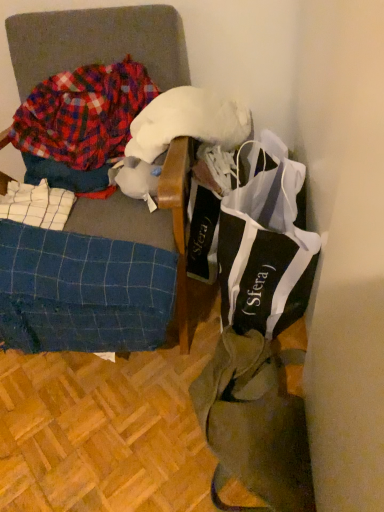
Describe the element at coordinates (100, 42) in the screenshot. I see `blue plaid fabric at left` at that location.

Image resolution: width=384 pixels, height=512 pixels. What do you see at coordinates (83, 114) in the screenshot? I see `plaid flannel shirt at left` at bounding box center [83, 114].

In order to face plaid flannel shirt at left, should I rotate leftwards or rightwards?

You should look left and rotate roughly 14.335 degrees.

Measure the distance between black and white fabric bag at right and camera.

black and white fabric bag at right and camera are 93.45 centimeters apart from each other.

This screenshot has width=384, height=512. What do you see at coordinates (266, 246) in the screenshot?
I see `black and white fabric bag at right` at bounding box center [266, 246].

Identify the location of blue plaid fabric at left. The image size is (384, 512). (100, 42).

Between white fluffy wool at upper center and blue checkered fabric at lower left, which one has larger width?

With larger width is white fluffy wool at upper center.

Is white fluffy wool at upper center with blue checkered fabric at lower left?

No, white fluffy wool at upper center is not with blue checkered fabric at lower left.

Is the depth of white fluffy wool at upper center greater than that of blue checkered fabric at lower left?

Yes, the depth of white fluffy wool at upper center is greater than that of blue checkered fabric at lower left.

In the scene shown: Is white fluffy wool at upper center at the left side of blue checkered fabric at lower left?

In fact, white fluffy wool at upper center is to the right of blue checkered fabric at lower left.

Based on the photo, is blue plaid fabric at left looking in the opposite direction of black and white fabric bag at right?

No.

From the image's perspective, would you say blue plaid fabric at left is shown under black and white fabric bag at right?

No, from the image's perspective, blue plaid fabric at left is not beneath black and white fabric bag at right.

Which is behind, point (134, 56) or point (302, 306)?

Point (302, 306)

Does blue plaid fabric at left appear on the left side of black and white fabric bag at right?

Indeed, blue plaid fabric at left is positioned on the left side of black and white fabric bag at right.

Who is more distant, black and white fabric bag at right or blue plaid fabric at left?

black and white fabric bag at right.

Considering the relative sizes of black and white fabric bag at right and blue plaid fabric at left in the image provided, is black and white fabric bag at right taller than blue plaid fabric at left?

In fact, black and white fabric bag at right may be shorter than blue plaid fabric at left.

Is black and white fabric bag at right spatially inside blue plaid fabric at left, or outside of it?

black and white fabric bag at right cannot be found inside blue plaid fabric at left.

Measure the distance from blue checkered fabric at lower left to white fluffy wool at upper center.

16.30 inches.

Is white fluffy wool at upper center surrounded by blue checkered fabric at lower left?

No, white fluffy wool at upper center is located outside of blue checkered fabric at lower left.

What's the angular difference between blue checkered fabric at lower left and white fluffy wool at upper center's facing directions?

blue checkered fabric at lower left and white fluffy wool at upper center are facing 40 degrees away from each other.

From the image's perspective, which object appears higher, blue checkered fabric at lower left or white fluffy wool at upper center?

white fluffy wool at upper center.

Measure the distance from plaid flannel shirt at left to black and white fabric bag at right.

plaid flannel shirt at left is 19.67 inches away from black and white fabric bag at right.

Would you say plaid flannel shirt at left is a long distance from black and white fabric bag at right?

plaid flannel shirt at left is near black and white fabric bag at right, not far away.

Looking at this image, from the image's perspective, which object appears higher, plaid flannel shirt at left or black and white fabric bag at right?

plaid flannel shirt at left appears higher in the image.

Could you tell me if plaid flannel shirt at left is turned towards black and white fabric bag at right?

No, plaid flannel shirt at left is not oriented towards black and white fabric bag at right.

Between white fluffy wool at upper center and olive green canvas tote bag at lower right, which one has smaller width?

white fluffy wool at upper center is thinner.

Is white fluffy wool at upper center taller or shorter than olive green canvas tote bag at lower right?

white fluffy wool at upper center is shorter than olive green canvas tote bag at lower right.

Which is closer, (177, 112) or (280, 375)?

Clearly, point (177, 112) is closer to the camera than point (280, 375).

In the scene shown: From a real-world perspective, relative to olive green canvas tote bag at lower right, is white fluffy wool at upper center vertically above or below?

white fluffy wool at upper center is situated higher than olive green canvas tote bag at lower right in the real world.

Is there a large distance between blue checkered fabric at lower left and black and white fabric bag at right?

No, blue checkered fabric at lower left is not far away from black and white fabric bag at right.

In the scene shown: Considering the sizes of blue checkered fabric at lower left and black and white fabric bag at right in the image, is blue checkered fabric at lower left taller or shorter than black and white fabric bag at right?

In the image, blue checkered fabric at lower left appears to be shorter than black and white fabric bag at right.

From the image's perspective, which is below, blue checkered fabric at lower left or black and white fabric bag at right?

blue checkered fabric at lower left appears lower in the image.

Is blue checkered fabric at lower left not inside black and white fabric bag at right?

blue checkered fabric at lower left lies outside black and white fabric bag at right's area.

I want to click on underclothes below the white fluffy wool at upper center (from the image's perspective), so click(x=82, y=292).

Identify the location of grocery bag behind the blue plaid fabric at left. This screenshot has height=512, width=384. (266, 246).

Based on the photo, from the image, which object appears to be farther from white fluffy wool at upper center, blue plaid fabric at left or black and white fabric bag at right?

Based on the image, black and white fabric bag at right appears to be further to white fluffy wool at upper center.

Based on their spatial positions, is black and white fabric bag at right or olive green canvas tote bag at lower right further from plaid flannel shirt at left?

olive green canvas tote bag at lower right.

Based on their spatial positions, is white fluffy wool at upper center or black and white fabric bag at right further from plaid flannel shirt at left?

Based on the image, black and white fabric bag at right appears to be further to plaid flannel shirt at left.

Estimate the real-world distances between objects in this image. Which object is further from blue checkered fabric at lower left, black and white fabric bag at right or plaid flannel shirt at left?

plaid flannel shirt at left is positioned further to the anchor blue checkered fabric at lower left.

Based on their spatial positions, is blue checkered fabric at lower left or plaid flannel shirt at left closer to white fluffy wool at upper center?

plaid flannel shirt at left lies closer to white fluffy wool at upper center than the other object.

Looking at the image, which one is located closer to black and white fabric bag at right, blue plaid fabric at left or blue checkered fabric at lower left?

blue checkered fabric at lower left lies closer to black and white fabric bag at right than the other object.

Looking at the image, which one is located closer to blue checkered fabric at lower left, blue plaid fabric at left or olive green canvas tote bag at lower right?

olive green canvas tote bag at lower right lies closer to blue checkered fabric at lower left than the other object.

Considering their positions, is black and white fabric bag at right positioned further to olive green canvas tote bag at lower right than blue plaid fabric at left?

blue plaid fabric at left.

At what (x,y) coordinates should I click in order to perform the action: click on wool that lies between plaid flannel shirt at left and blue checkered fabric at lower left from top to bottom. Please return your answer as a coordinate pair (x, y). The image size is (384, 512). Looking at the image, I should click on (187, 122).

Where is `underclothes between blue plaid fabric at left and black and white fabric bag at right from left to right`? This screenshot has width=384, height=512. underclothes between blue plaid fabric at left and black and white fabric bag at right from left to right is located at coordinates (82, 292).

Locate an element on the screen. Image resolution: width=384 pixels, height=512 pixels. grocery bag that lies between blue plaid fabric at left and olive green canvas tote bag at lower right from top to bottom is located at coordinates (266, 246).

Where is `wool between plaid flannel shirt at left and black and white fabric bag at right`? This screenshot has width=384, height=512. wool between plaid flannel shirt at left and black and white fabric bag at right is located at coordinates (187, 122).